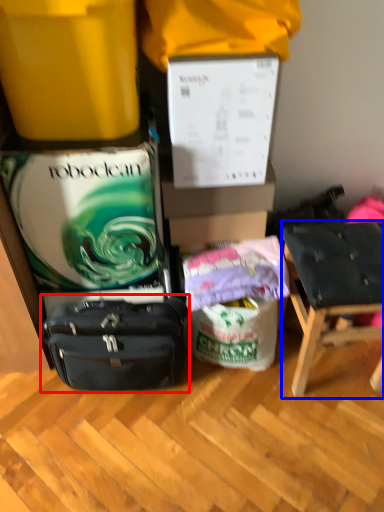
Question: Which point is closer to the camera, luggage and bags (highlighted by a red box) or chair (highlighted by a blue box)?

Choices:
 (A) luggage and bags
 (B) chair

Answer: (B)